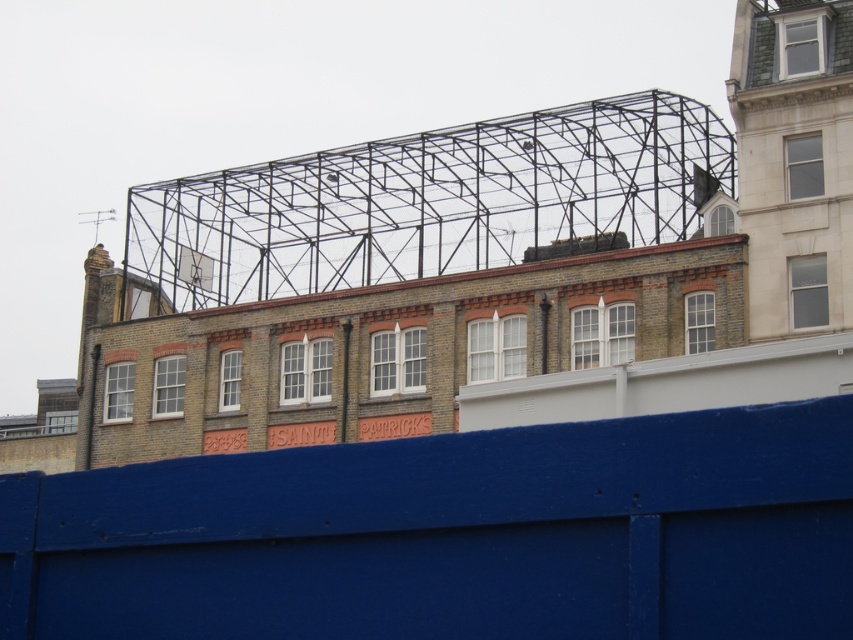
Is blue painted wood at center wider than black metal scaffolding at upper center?

Incorrect, blue painted wood at center's width does not surpass black metal scaffolding at upper center's.

Who is taller, blue painted wood at center or black metal scaffolding at upper center?

black metal scaffolding at upper center is taller.

Is point (590, 532) less distant than point (238, 179)?

Yes, point (590, 532) is in front of point (238, 179).

This screenshot has width=853, height=640. Find the location of `blue painted wood at center`. blue painted wood at center is located at coordinates (453, 536).